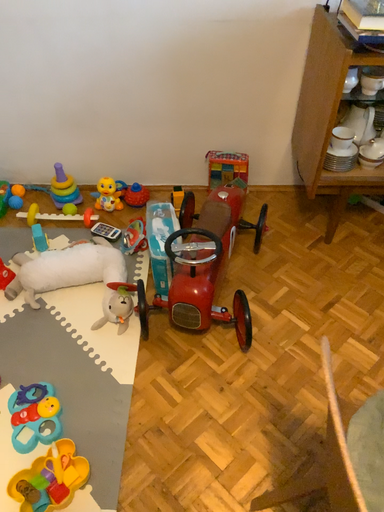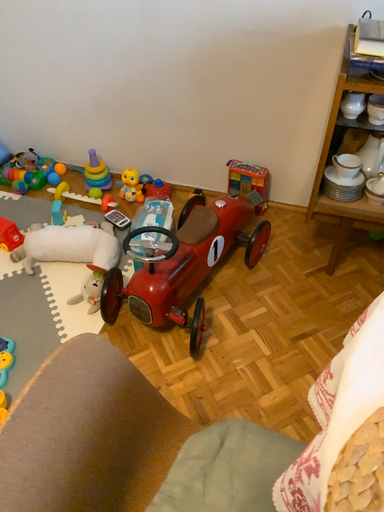
Question: How did the camera likely rotate when shooting the video?

Choices:
 (A) rotated right
 (B) rotated left

Answer: (B)